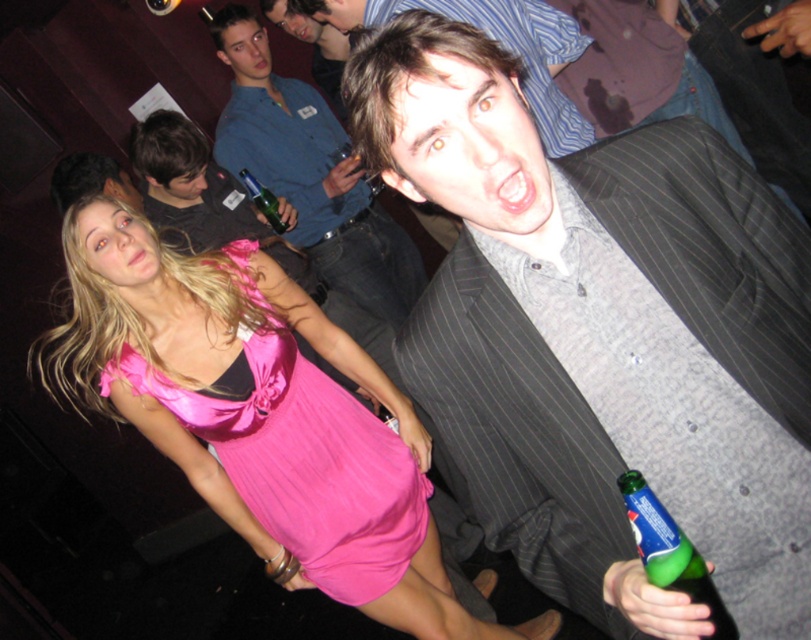
This screenshot has height=640, width=811. In order to click on matte black suit at upper right in this screenshot , I will do click(204, 196).

Can you confirm if gray pinstripe suit at center is bigger than gray pinstripe suit at upper right?

Incorrect, gray pinstripe suit at center is not larger than gray pinstripe suit at upper right.

Is gray pinstripe suit at center to the left of gray pinstripe suit at upper right from the viewer's perspective?

Incorrect, gray pinstripe suit at center is not on the left side of gray pinstripe suit at upper right.

Is point (618, 275) closer to viewer compared to point (389, 316)?

Yes, it is in front of point (389, 316).

The width and height of the screenshot is (811, 640). I want to click on gray pinstripe suit at center, so click(601, 333).

How distant is pink satin dress at lower left from matte black suit at upper right?

pink satin dress at lower left and matte black suit at upper right are 33.59 inches apart.

Can you confirm if pink satin dress at lower left is positioned to the left of matte black suit at upper right?

Incorrect, pink satin dress at lower left is not on the left side of matte black suit at upper right.

Is point (307, 365) closer to viewer compared to point (200, 214)?

That is True.

The width and height of the screenshot is (811, 640). In order to click on pink satin dress at lower left in this screenshot , I will do `click(303, 458)`.